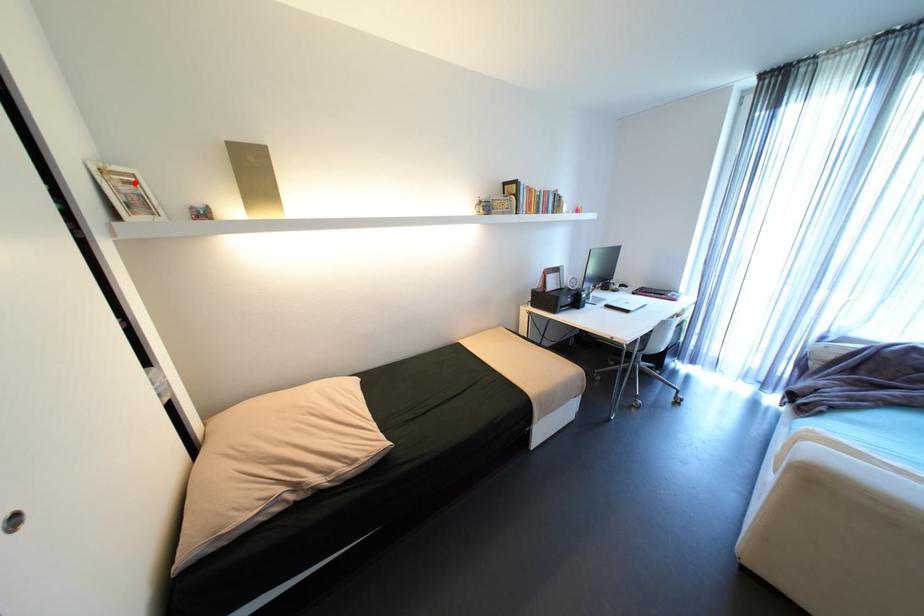
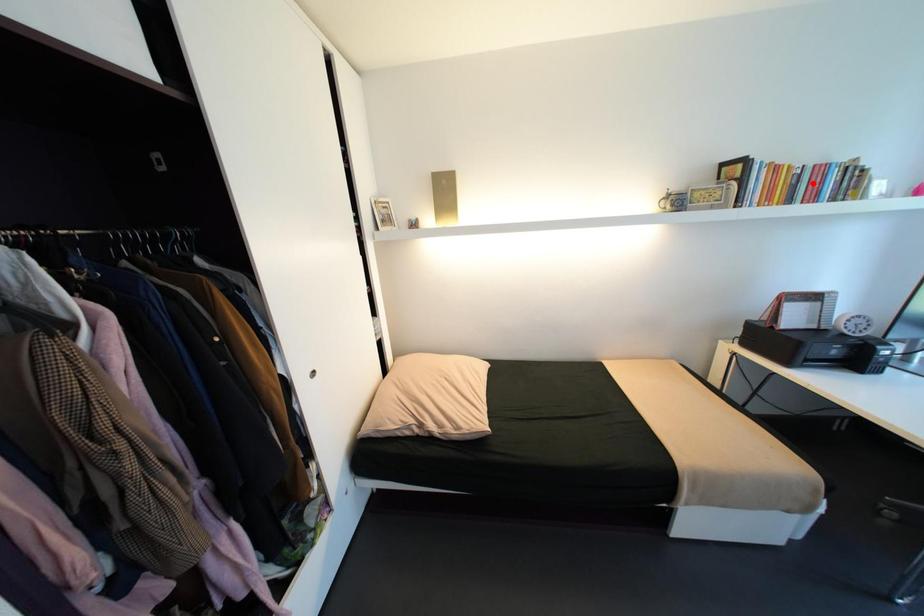
I am providing you with two images of the same scene from different viewpoints. A red point is marked on the first image and another point is marked on the second image. Do the highlighted points in image1 and image2 indicate the same real-world spot?

No